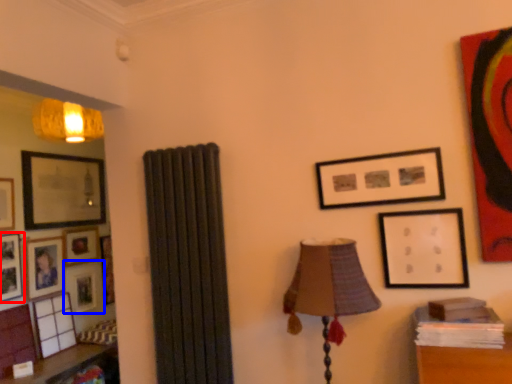
Question: Which object is further to the camera taking this photo, picture frame (highlighted by a red box) or picture frame (highlighted by a blue box)?

Choices:
 (A) picture frame
 (B) picture frame

Answer: (B)